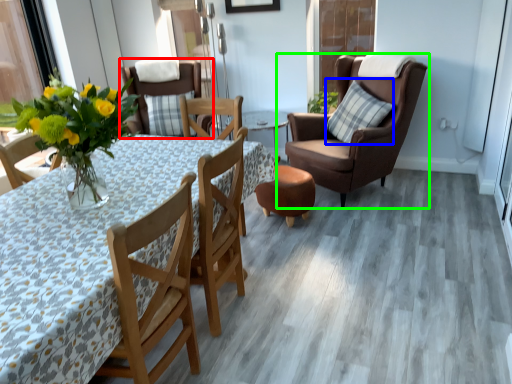
Question: Considering the real-world distances, which object is closest to chair (highlighted by a red box)? pillow (highlighted by a blue box) or chair (highlighted by a green box).

Choices:
 (A) pillow
 (B) chair

Answer: (B)